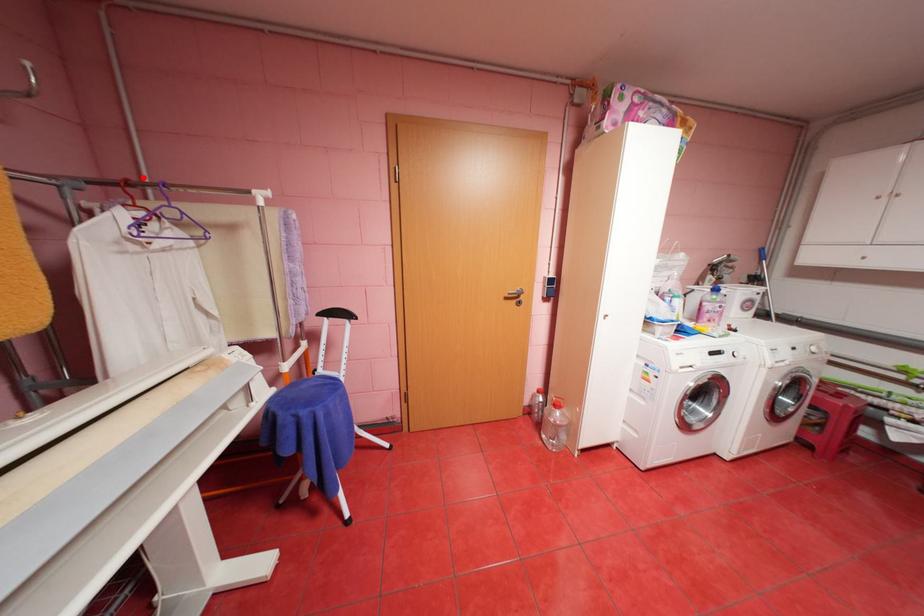
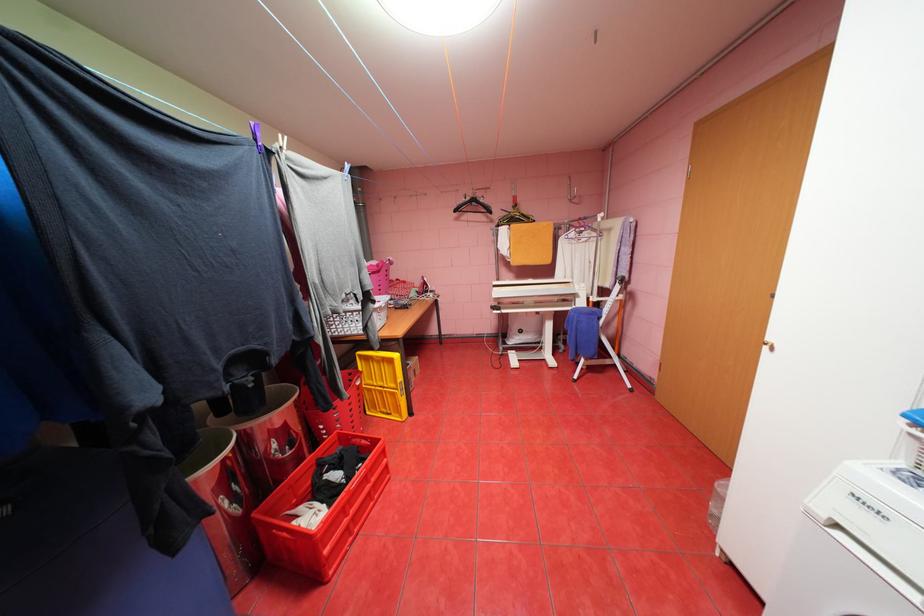
Find the pixel in the second image that matches the highlighted location in the first image.

(591, 216)